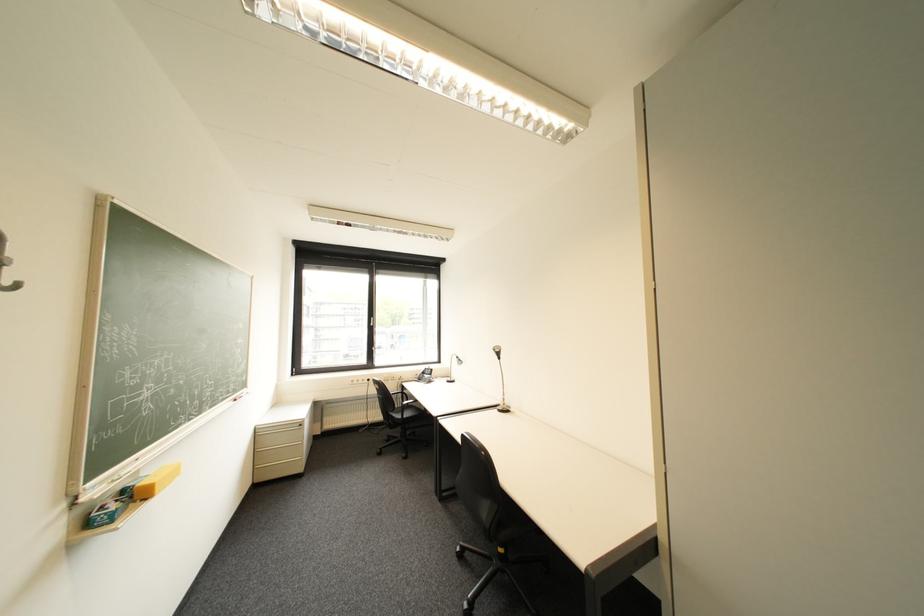
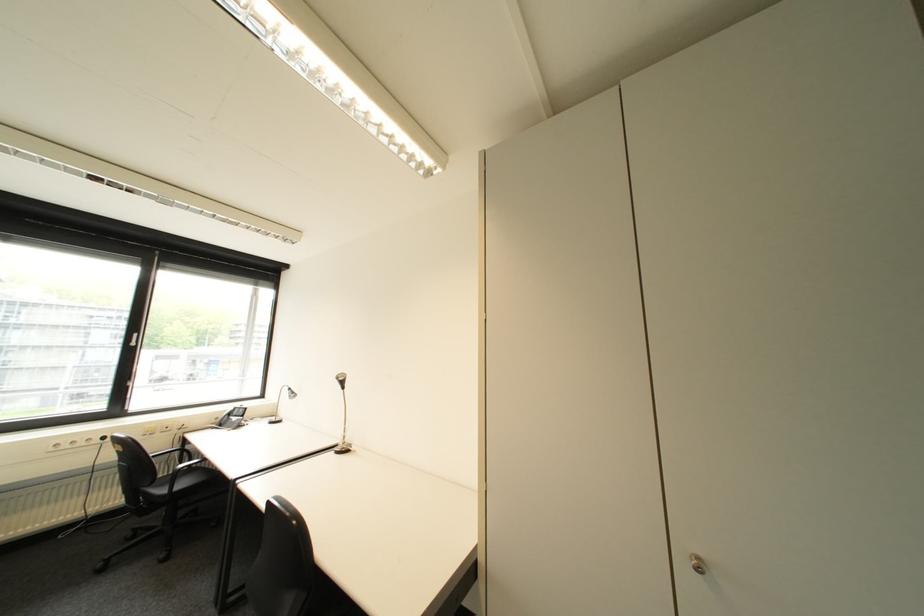
The point at (435, 369) is marked in the first image. Where is the corresponding point in the second image?

(246, 408)